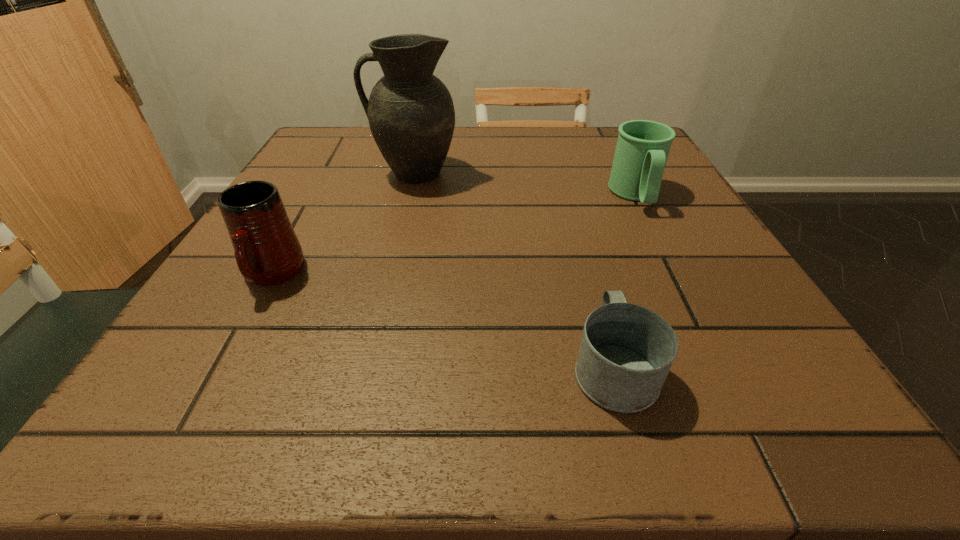
What are the coordinates of `free space located on the side of the rightmost mug with the handle` in the screenshot? It's located at (664, 252).

Find the location of `vacant area situated 0.360m on the side of the shortest mug with the handle`. vacant area situated 0.360m on the side of the shortest mug with the handle is located at coordinates (565, 197).

Image resolution: width=960 pixels, height=540 pixels. Find the location of `free space located 0.370m on the side of the shortest mug with the handle`. free space located 0.370m on the side of the shortest mug with the handle is located at coordinates (564, 194).

The image size is (960, 540). Identify the location of free space located 0.190m on the side of the shortest mug with the handle. click(x=580, y=246).

In order to click on object located at the far edge in this screenshot , I will do `click(411, 114)`.

Locate an element on the screen. The image size is (960, 540). object at the near edge is located at coordinates (626, 352).

Where is `object positioned at the left edge`? The width and height of the screenshot is (960, 540). object positioned at the left edge is located at coordinates (267, 251).

Locate an element on the screen. object located at the right edge is located at coordinates (643, 146).

The height and width of the screenshot is (540, 960). I want to click on free space at the far edge, so click(371, 160).

Where is `vacant area at the near edge`? vacant area at the near edge is located at coordinates (552, 394).